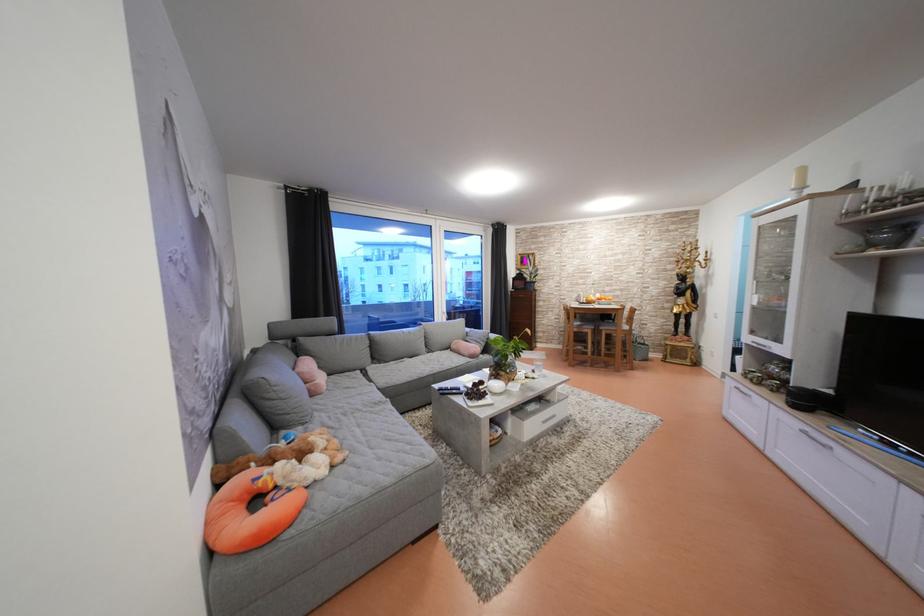
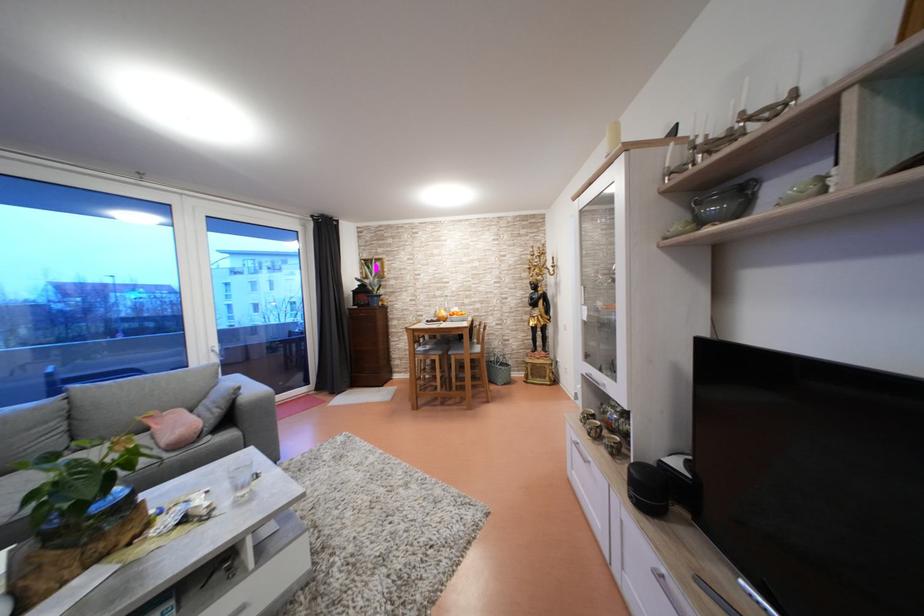
Where in the second image is the point corresponding to point 588,286 from the first image?

(444, 299)